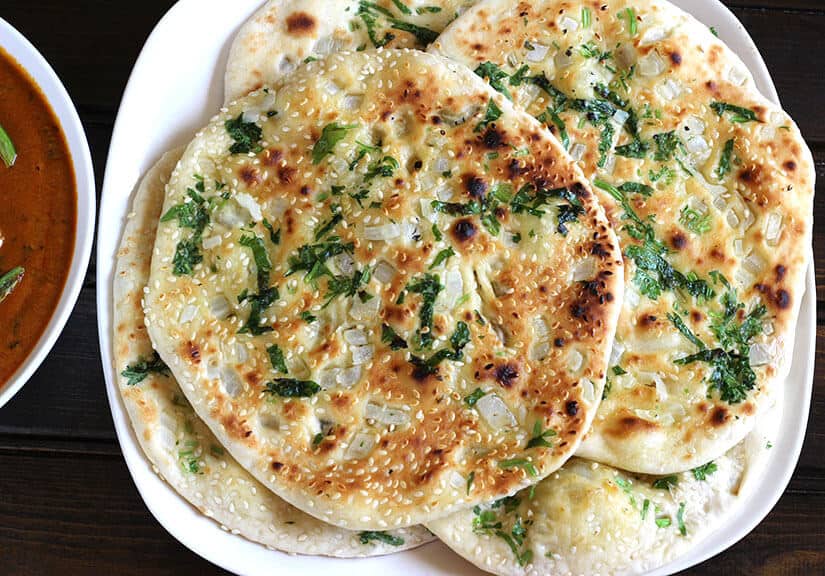
This screenshot has height=576, width=825. Identify the location of wooden surface under plate and bowl with food. (82, 507).